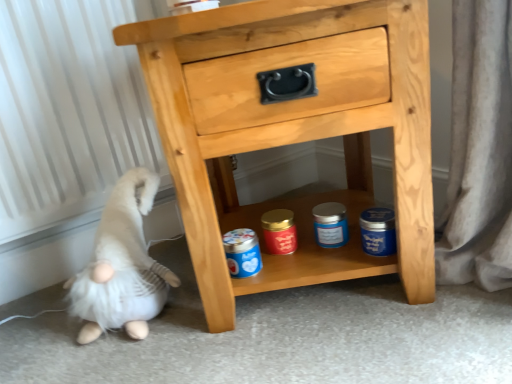
Question: Considering their positions, is white plush gnome at lower left located in front of or behind natural wood chest of drawers at center?

Choices:
 (A) front
 (B) behind

Answer: (B)

Question: From the image's perspective, is white plush gnome at lower left located above or below natural wood chest of drawers at center?

Choices:
 (A) below
 (B) above

Answer: (A)

Question: In terms of height, does white plush gnome at lower left look taller or shorter compared to natural wood chest of drawers at center?

Choices:
 (A) short
 (B) tall

Answer: (A)

Question: Looking at their shapes, would you say natural wood chest of drawers at center is wider or thinner than white plush gnome at lower left?

Choices:
 (A) thin
 (B) wide

Answer: (B)

Question: From their relative heights in the image, would you say natural wood chest of drawers at center is taller or shorter than white plush gnome at lower left?

Choices:
 (A) tall
 (B) short

Answer: (A)

Question: Considering the relative positions of natural wood chest of drawers at center and white plush gnome at lower left in the image provided, is natural wood chest of drawers at center to the left or to the right of white plush gnome at lower left?

Choices:
 (A) left
 (B) right

Answer: (B)

Question: Does point (377, 16) appear closer or farther from the camera than point (146, 198)?

Choices:
 (A) closer
 (B) farther

Answer: (A)